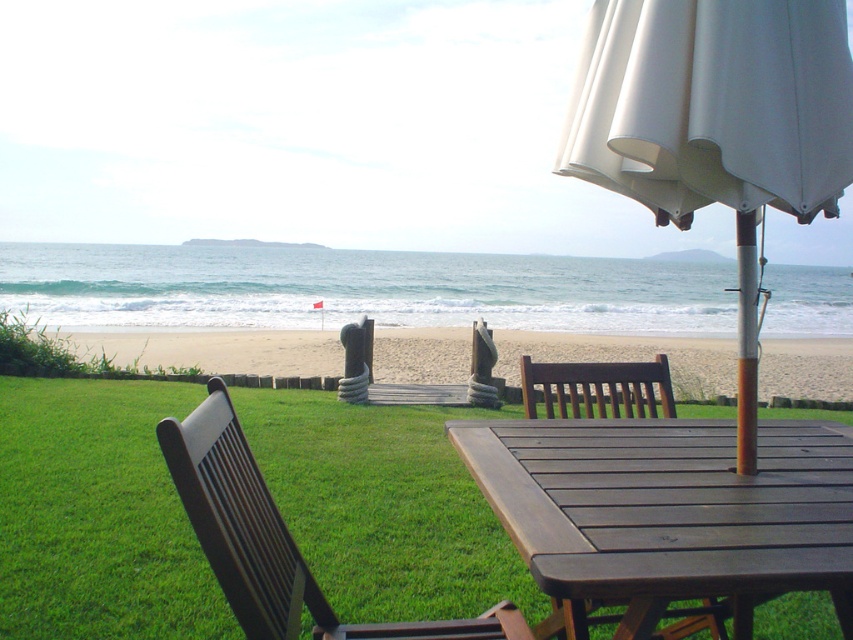
Is blue water at center closer to camera compared to beige sand at center?

No.

Does point (444, 308) lie in front of point (723, 364)?

No.

Find the location of a particular element. The image size is (853, 640). blue water at center is located at coordinates (360, 289).

Can you confirm if white fabric umbrella at upper right is positioned above dark brown wood chair at center?

Yes, white fabric umbrella at upper right is above dark brown wood chair at center.

Can you confirm if white fabric umbrella at upper right is bigger than dark brown wood chair at center?

Correct, white fabric umbrella at upper right is larger in size than dark brown wood chair at center.

Is point (700, 22) positioned in front of point (711, 630)?

Yes, it is.

The image size is (853, 640). Identify the location of white fabric umbrella at upper right. (717, 124).

Which is more to the right, dark brown wood table at center or brown wood bench at center?

From the viewer's perspective, dark brown wood table at center appears more on the right side.

Between dark brown wood table at center and brown wood bench at center, which one is positioned lower?

Positioned lower is dark brown wood table at center.

You are a GUI agent. You are given a task and a screenshot of the screen. Output one action in this format:
    pyautogui.click(x=<x>, y=<y>)
    Task: Click on the dark brown wood table at center
    The width and height of the screenshot is (853, 640).
    Given the screenshot: What is the action you would take?
    pyautogui.click(x=666, y=512)